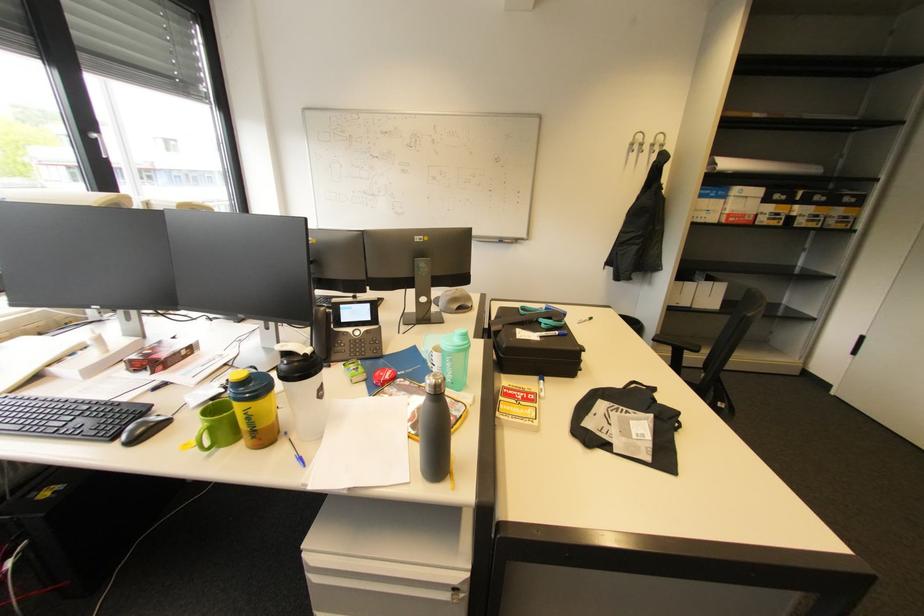
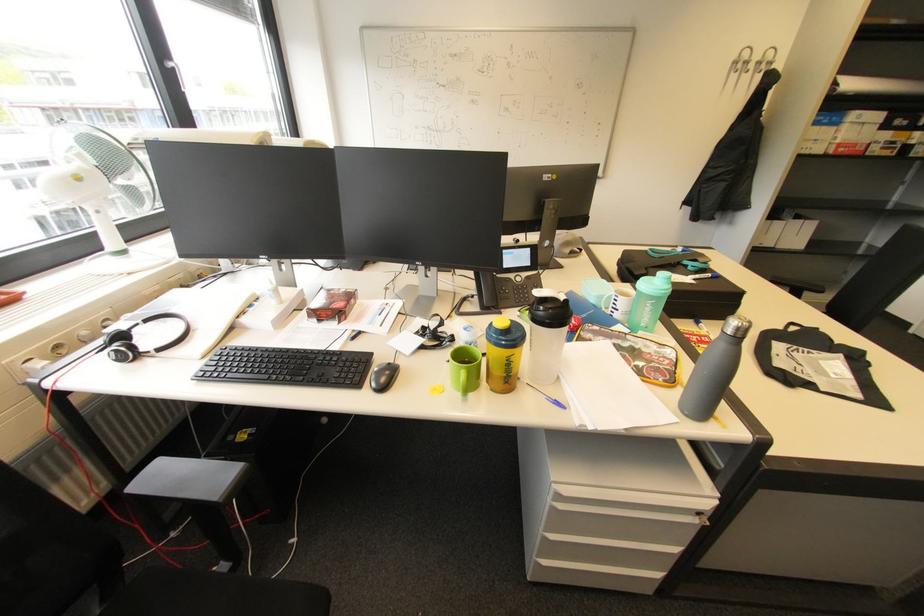
Locate, in the second image, the point that corresponds to the point at 538,399 in the first image.

(713, 341)